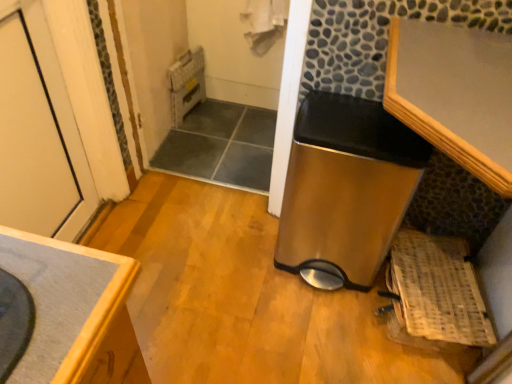
This screenshot has height=384, width=512. I want to click on vacant space in front of metallic gray water heater at upper center, the first water heater viewed from the back, so click(184, 130).